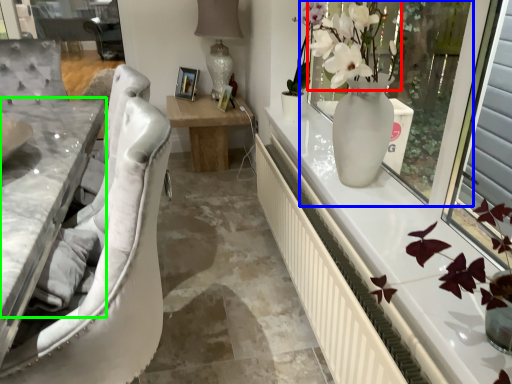
Question: Which object is the farthest from floral arrangement (highlighted by a red box)? Choose among these: window screen (highlighted by a blue box) or counter top (highlighted by a green box).

Choices:
 (A) window screen
 (B) counter top

Answer: (B)